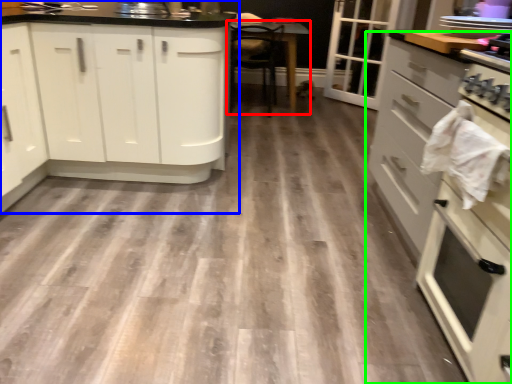
Question: Based on their relative distances, which object is nearer to table (highlighted by a red box)? Choose from cabinetry (highlighted by a blue box) and cabinetry (highlighted by a green box).

Choices:
 (A) cabinetry
 (B) cabinetry

Answer: (A)